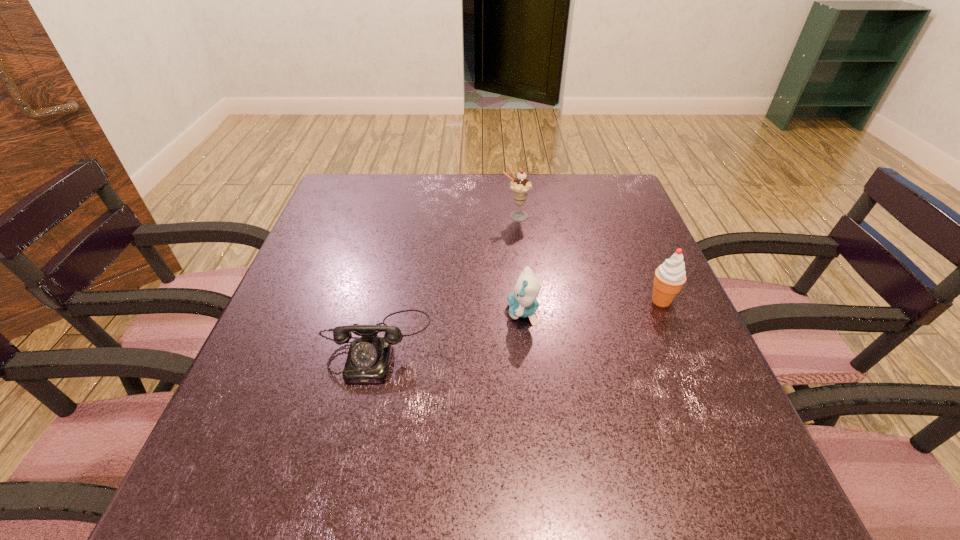
Find the location of `free space that is in between the leftmost object and the kitten`. free space that is in between the leftmost object and the kitten is located at coordinates click(x=449, y=328).

Choose which object is the second nearest neighbor to the shortest object. Please provide its 2D coordinates. Your answer should be formatted as a tuple, i.e. [(x, y)], where the tuple contains the x and y coordinates of a point satisfying the conditions above.

[(520, 186)]

Select which object appears as the closest to the kitten. Please provide its 2D coordinates. Your answer should be formatted as a tuple, i.e. [(x, y)], where the tuple contains the x and y coordinates of a point satisfying the conditions above.

[(368, 360)]

The width and height of the screenshot is (960, 540). Find the location of `vacant space that satisfies the following two spatial constraints: 1. on the front side of the left icecream; 2. on the face of the kitten`. vacant space that satisfies the following two spatial constraints: 1. on the front side of the left icecream; 2. on the face of the kitten is located at coordinates (525, 312).

Image resolution: width=960 pixels, height=540 pixels. What are the coordinates of `vacant point that satisfies the following two spatial constraints: 1. on the front side of the left icecream; 2. on the right side of the rightmost object` in the screenshot? It's located at (524, 301).